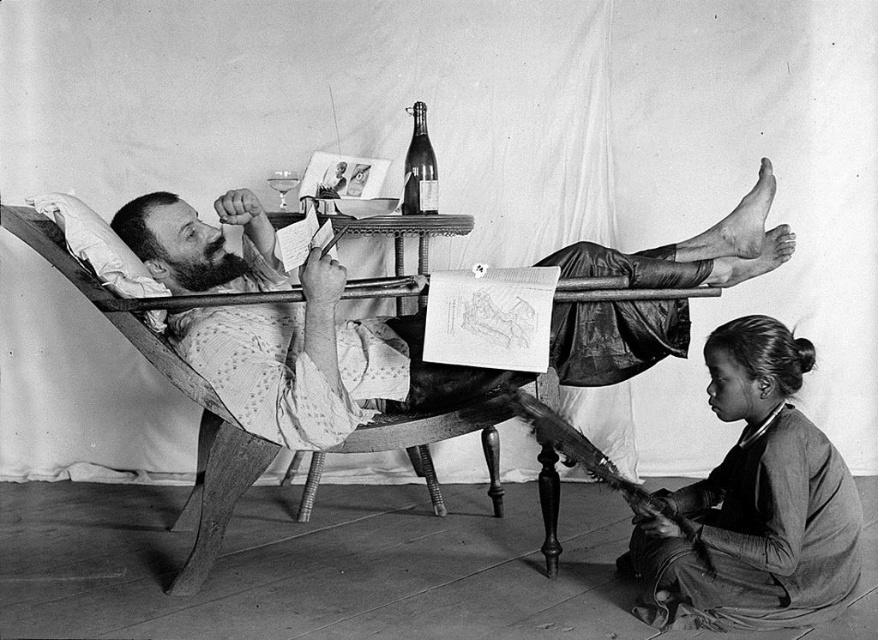
Question: Which is nearer to the smooth dark fabric at lower right?

Choices:
 (A) shiny glass bottle at center
 (B) spotted cotton shirt at center

Answer: (B)

Question: Which of these objects is positioned farthest from the spotted cotton shirt at center?

Choices:
 (A) shiny glass bottle at center
 (B) smooth dark fabric at lower right

Answer: (A)

Question: Is spotted cotton shirt at center bigger than smooth dark fabric at lower right?

Choices:
 (A) no
 (B) yes

Answer: (B)

Question: Is spotted cotton shirt at center thinner than shiny glass bottle at center?

Choices:
 (A) yes
 (B) no

Answer: (B)

Question: Is spotted cotton shirt at center thinner than shiny glass bottle at center?

Choices:
 (A) yes
 (B) no

Answer: (B)

Question: Which point is farther from the camera taking this photo?

Choices:
 (A) (713, 336)
 (B) (268, 346)

Answer: (B)